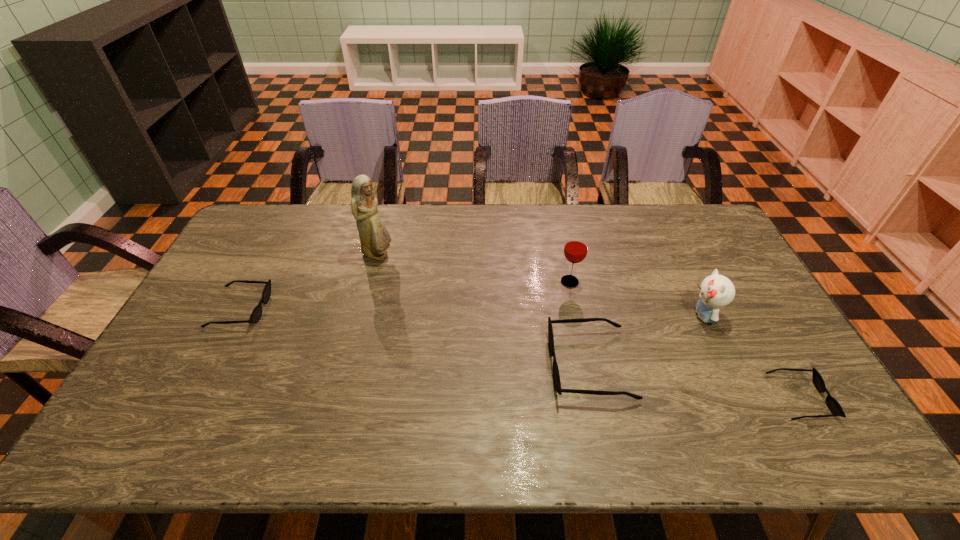
Select which sunglasses appears as the closest to the fourth shortest object. Please provide its 2D coordinates. Your answer should be formatted as a tuple, i.e. [(x, y)], where the tuple contains the x and y coordinates of a point satisfying the conditions above.

[(832, 404)]

Find the location of a particular element. This screenshot has height=540, width=960. sunglasses that is the closest one to the tallest object is located at coordinates (256, 314).

Identify the location of free location that satisfies the following two spatial constraints: 1. on the back side of the glass; 2. on the front-facing side of the figurine. The width and height of the screenshot is (960, 540). (564, 255).